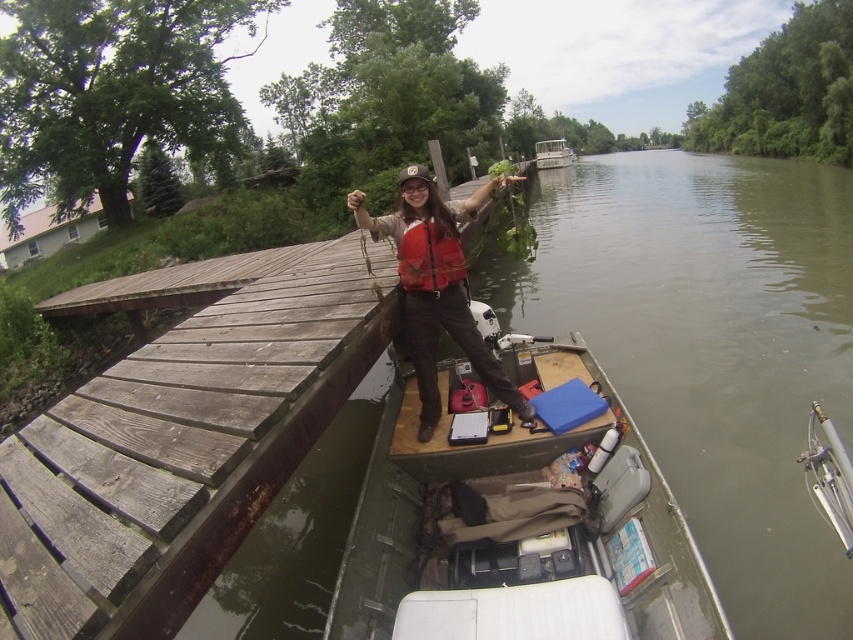
You are navigating a narrow waterway and need to pass between the weathered wood dock at upper left and the green plastic boat at upper center. Which direction should you steer to avoid collision?

You should steer to the right side of the green plastic boat at upper center because the weathered wood dock at upper left is positioned on the left side of it, so moving right would keep you clear of both objects.

You are standing on the wooden dock and see the wooden table at center and the green plastic boat at upper center. Which object is closer to you?

The wooden table at center is closer to you because it is in front of the green plastic boat at upper center.